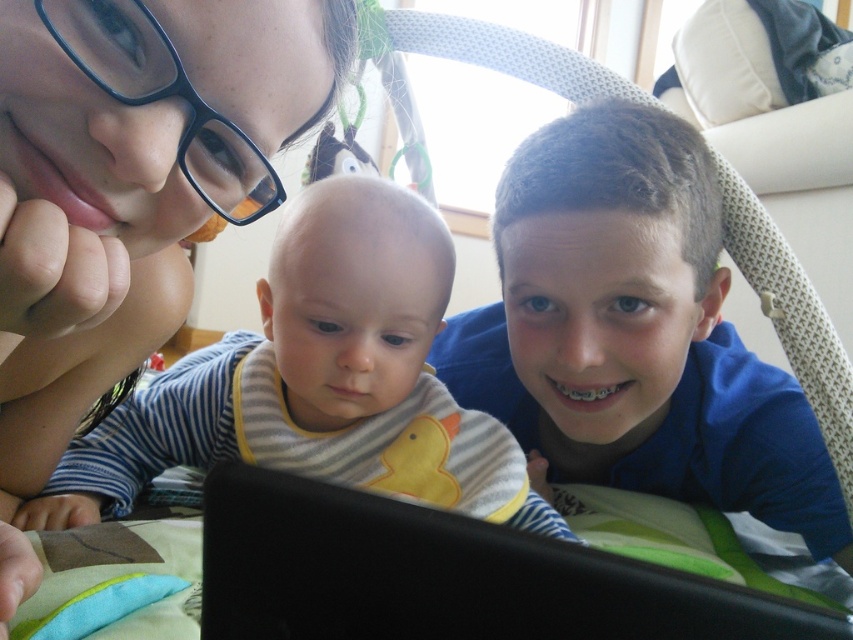
What do you see at coordinates (309, 371) in the screenshot? The height and width of the screenshot is (640, 853). I see `striped fabric bib at center` at bounding box center [309, 371].

You are a GUI agent. You are given a task and a screenshot of the screen. Output one action in this format:
    pyautogui.click(x=<x>, y=<y>)
    Task: Click on the striped fabric bib at center
    
    Given the screenshot: What is the action you would take?
    pyautogui.click(x=309, y=371)

Image resolution: width=853 pixels, height=640 pixels. What are the coordinates of `striped fabric bib at center` in the screenshot? It's located at click(309, 371).

From the picture: Between matte black glasses at upper left and striped fabric bib at center, which one appears on the left side from the viewer's perspective?

matte black glasses at upper left is more to the left.

At what (x,y) coordinates should I click in order to perform the action: click on matte black glasses at upper left. Please return your answer as a coordinate pair (x, y). The width and height of the screenshot is (853, 640). Looking at the image, I should click on (142, 145).

Locate an element on the screen. The image size is (853, 640). matte black glasses at upper left is located at coordinates (142, 145).

Which of these two, matte black glasses at upper left or black matte laptop at center, stands taller?

Standing taller between the two is matte black glasses at upper left.

Describe the element at coordinates (142, 145) in the screenshot. I see `matte black glasses at upper left` at that location.

At what (x,y) coordinates should I click in order to perform the action: click on matte black glasses at upper left. Please return your answer as a coordinate pair (x, y). This screenshot has height=640, width=853. Looking at the image, I should click on (142, 145).